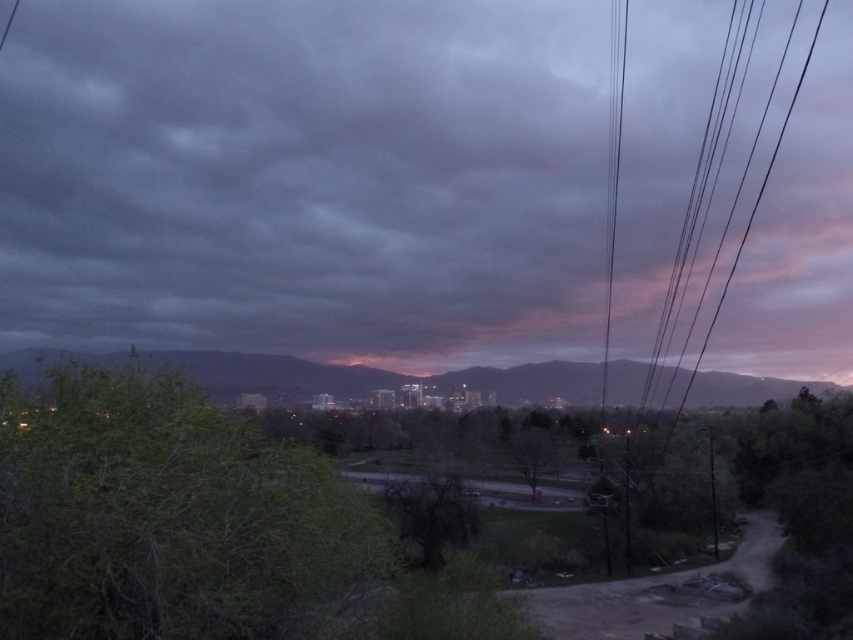
Based on the photo, based on the scene description, can you determine the spatial relationship between the rocky mountain at center and the black wire at right? Specifically, is the rocky mountain positioned above or below the black wire?

The rocky mountain at center is below the black wire at right according to the description.